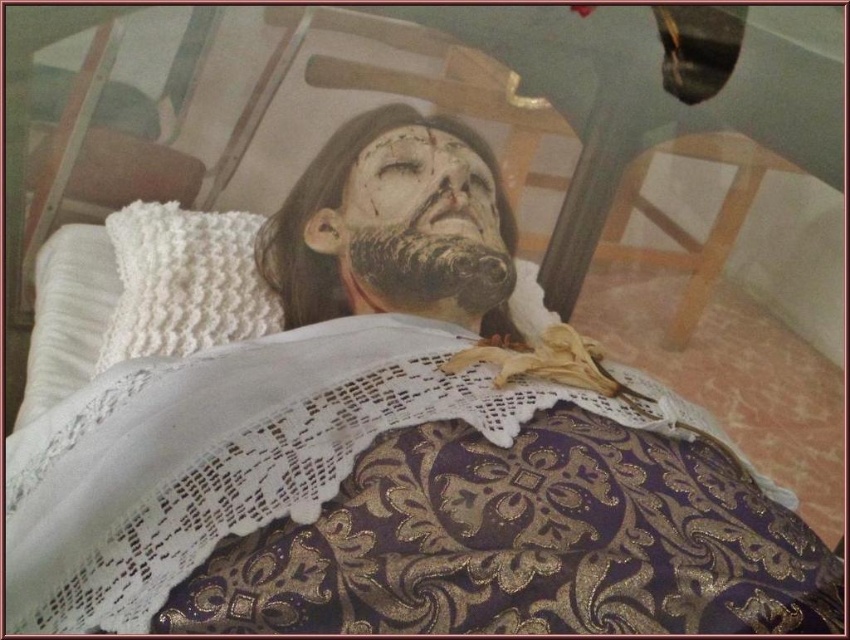
You are an artist trying to paint the scene described. You need to determine which of the two points, point (364, 177) or point (360, 257), is closer to the viewer. Which one should you paint first to create a proper perspective?

Point (364, 177) is further to the viewer than point (360, 257), so you should paint point (364, 177) first to establish the foreground elements before moving to the background.

What is located at the coordinates point (375, 499) in the image?

The lace fabric at center is located at point (375, 499).

You are an artist examining the figure in the image. You notice a point marked at coordinates (375, 499). Based on the scene description, what object is located at this point?

The point at (375, 499) indicates the lace fabric at center.